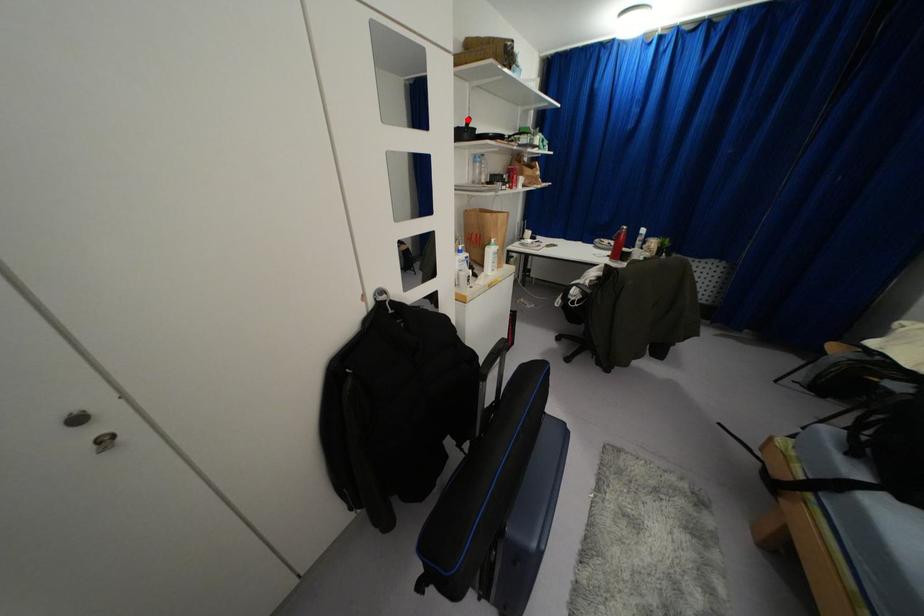
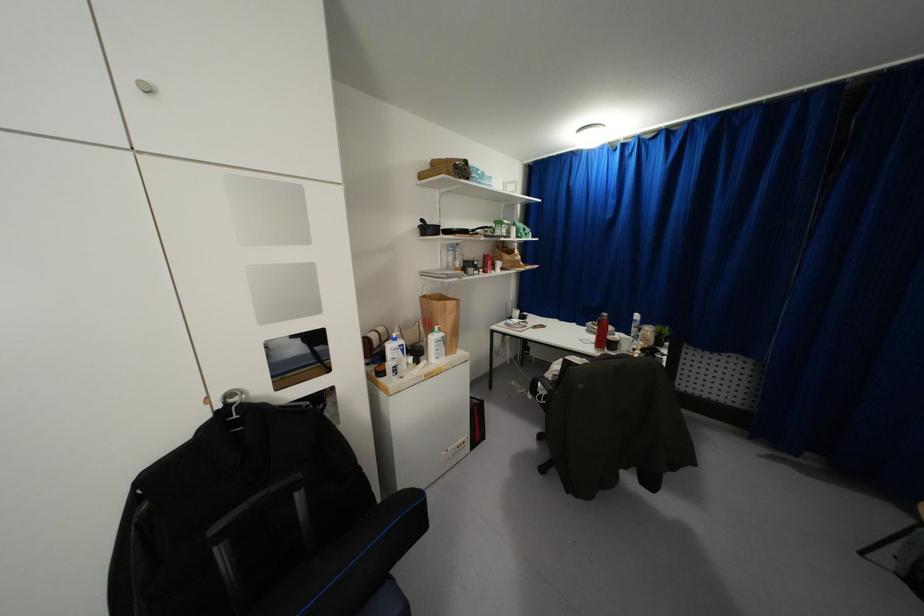
The point at the highlighted location is marked in the first image. Where is the corresponding point in the second image?

(421, 220)